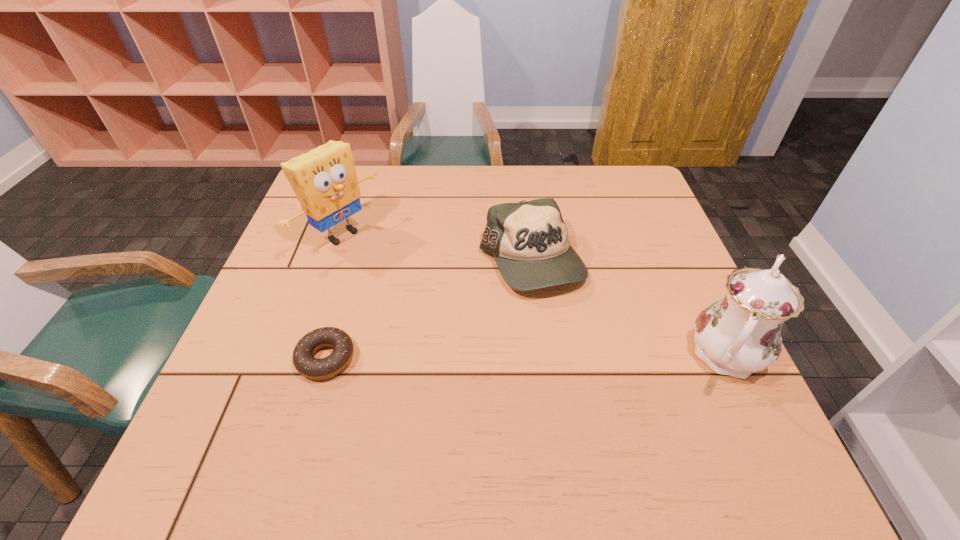
Identify the location of vacant area between the second shortest object and the rightmost object. (629, 308).

In order to click on vacant space that's between the shortest object and the sponge in this screenshot , I will do `click(333, 296)`.

Find the location of a particular element. Image resolution: width=960 pixels, height=540 pixels. vacant area between the shortest object and the rightmost object is located at coordinates (526, 356).

Find the location of a particular element. free area in between the sponge and the baseball cap is located at coordinates (436, 248).

The height and width of the screenshot is (540, 960). In order to click on empty space that is in between the doughnut and the baseball cap in this screenshot , I will do `click(429, 310)`.

You are a GUI agent. You are given a task and a screenshot of the screen. Output one action in this format:
    pyautogui.click(x=<x>, y=<y>)
    Task: Click on the free spot between the baseball cap and the sponge
    
    Given the screenshot: What is the action you would take?
    pyautogui.click(x=436, y=248)

The height and width of the screenshot is (540, 960). In order to click on free space that is in between the third tallest object and the doughnut in this screenshot , I will do `click(429, 310)`.

You are a GUI agent. You are given a task and a screenshot of the screen. Output one action in this format:
    pyautogui.click(x=<x>, y=<y>)
    Task: Click on the unoccupied position between the doughnut and the sponge
    
    Given the screenshot: What is the action you would take?
    pyautogui.click(x=333, y=296)

Identify which object is the second closest to the sponge. Please provide its 2D coordinates. Your answer should be formatted as a tuple, i.e. [(x, y)], where the tuple contains the x and y coordinates of a point satisfying the conditions above.

[(529, 240)]

At what (x,y) coordinates should I click in order to perform the action: click on object identified as the closest to the third object from left to right. Please return your answer as a coordinate pair (x, y). The width and height of the screenshot is (960, 540). Looking at the image, I should click on click(740, 334).